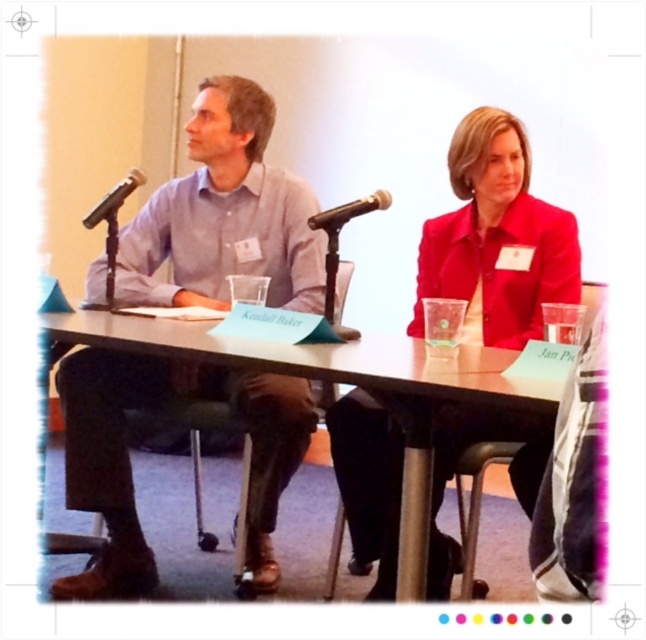
Looking at this image, you are standing in front of the long table where two people are seated. There is a point at coordinates (224, 212). Can you determine which object this point is located on?

The point at coordinates (224, 212) is located on the matte light blue shirt at center.

You are a guest speaker at a conference and need to adjust your posture to reach the black plastic microphone at center on the brown wood table at center. Based on the scene, what might you need to do to comfortably reach the microphone?

The brown wood table at center is much taller than the black plastic microphone at center, so you might need to stand up or adjust your chair height to comfortably reach the microphone.